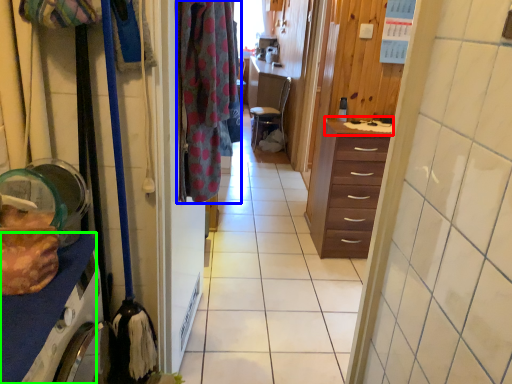
Question: Based on their relative distances, which object is farther from counter top (highlighted by a red box)? Choose from clothing (highlighted by a blue box) and cabinetry (highlighted by a green box).

Choices:
 (A) clothing
 (B) cabinetry

Answer: (B)